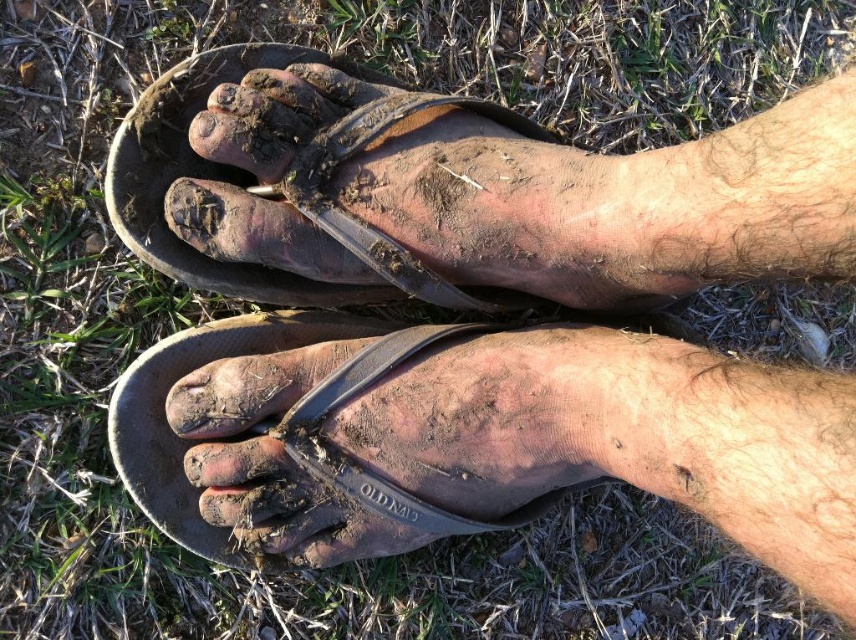
Question: Is brown leather toe at lower center below brown matte toe at upper center?

Choices:
 (A) yes
 (B) no

Answer: (A)

Question: Does brown leather toe at lower center have a smaller size compared to brown matte toe at upper center?

Choices:
 (A) yes
 (B) no

Answer: (B)

Question: Which of the following is the farthest from the observer?

Choices:
 (A) brown matte toe at upper center
 (B) brown leather toe at lower center
 (C) muddy rubber flip-flop at center

Answer: (B)

Question: Which of the following is the farthest from the observer?

Choices:
 (A) (221, 442)
 (B) (152, 397)

Answer: (B)

Question: In this image, where is muddy rubber flip-flop at center located relative to brown matte toe at upper center?

Choices:
 (A) left
 (B) right

Answer: (B)

Question: Which point is closer to the camera?

Choices:
 (A) (236, 106)
 (B) (128, 486)

Answer: (A)